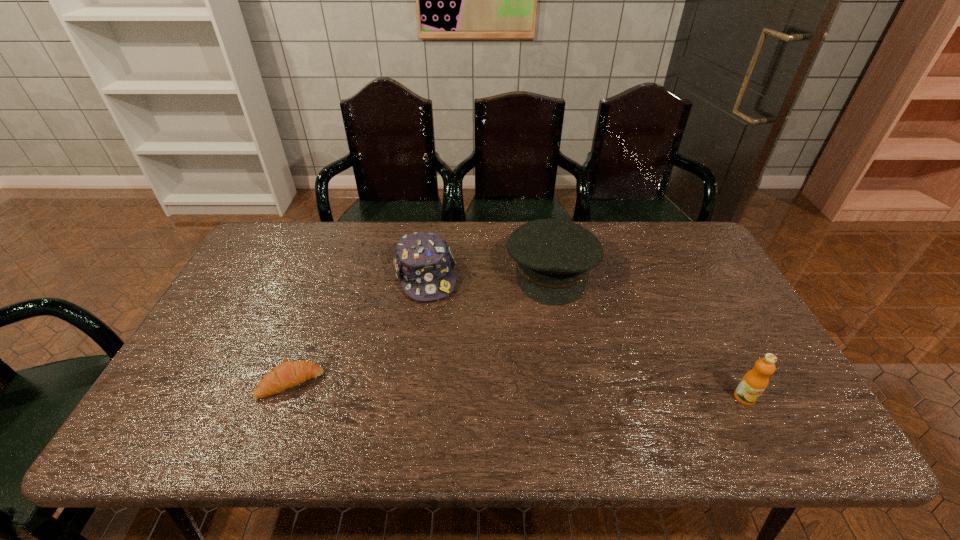
This screenshot has height=540, width=960. Identify the location of vacant point located 0.300m on the front-facing side of the headwear. (458, 387).

In order to click on blank area located on the front-facing side of the headwear in this screenshot , I will do `click(464, 404)`.

Where is `free spot located on the front-facing side of the headwear`? This screenshot has height=540, width=960. free spot located on the front-facing side of the headwear is located at coordinates (459, 390).

The width and height of the screenshot is (960, 540). I want to click on beret that is at the far edge, so click(553, 257).

Find the location of `headwear that is positioned at the far edge`. headwear that is positioned at the far edge is located at coordinates (424, 264).

Locate an element on the screen. The image size is (960, 540). crescent roll at the near edge is located at coordinates (288, 374).

Where is `orange juice at the near edge`? The width and height of the screenshot is (960, 540). orange juice at the near edge is located at coordinates (755, 381).

Image resolution: width=960 pixels, height=540 pixels. Identify the location of object that is positioned at the right edge. (755, 381).

Where is `object that is at the near right corner`? This screenshot has width=960, height=540. object that is at the near right corner is located at coordinates (755, 381).

At what (x,y) coordinates should I click in order to perform the action: click on free space at the far edge of the desktop. Please return your answer as a coordinate pair (x, y). Image resolution: width=960 pixels, height=540 pixels. Looking at the image, I should click on (616, 222).